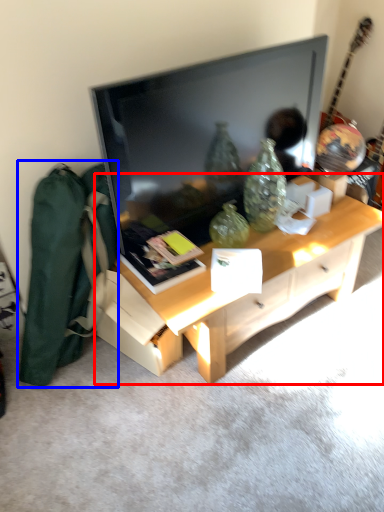
Question: Which point is closer to the camera, desk (highlighted by a red box) or messenger bag (highlighted by a blue box)?

Choices:
 (A) desk
 (B) messenger bag

Answer: (B)